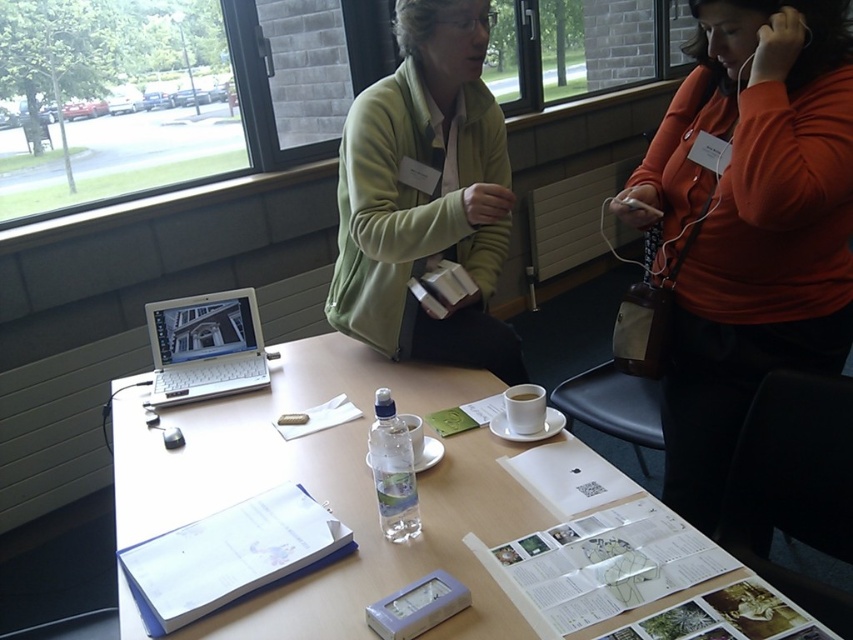
You are organizing a meeting and need to place a 15 cm wide document on the table between the white plastic laptop at center and the white ceramic cup at center. Can the document fit between them?

The white plastic laptop at center is larger in size than the white ceramic cup at center. Since the laptop is larger, the space between them might be sufficient, but without knowing the exact distance, it is hard to determine if the 15 cm wide document will fit. However, if the total available space between them is at least 15 cm, the document can fit.

You are organizing a meeting in this room and need to place a name tag on the table. The name tag is 10 cm wide. You want to place it between the green fleece jacket at upper center and the white ceramic cup at center. Is there enough space?

The green fleece jacket at upper center is positioned on the left side of white ceramic cup at center, so there is space between them. However, the exact distance isn t specified, so it s uncertain if it s exactly 10 cm. You should check the actual spacing to ensure the name tag fits.